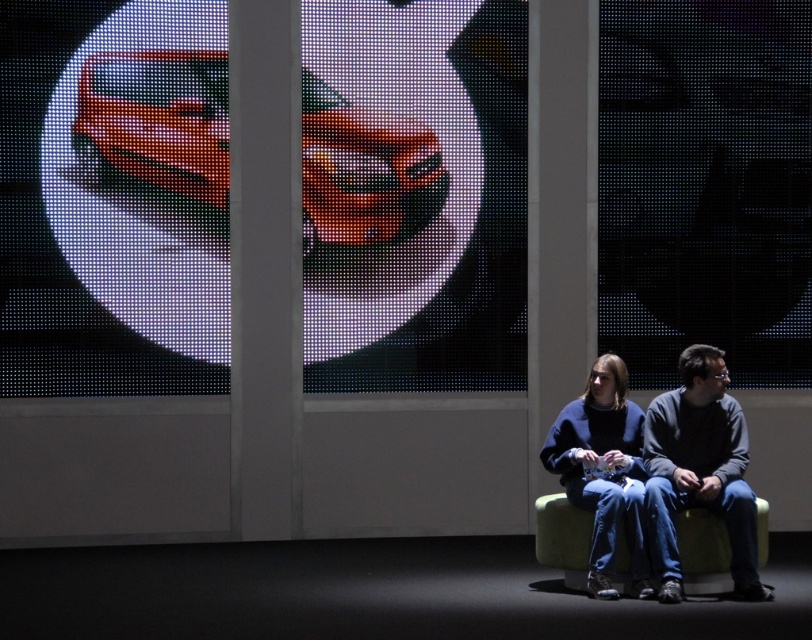
You are a photographer trying to capture a photo of both the dark gray sweater at center right and the blue fleece sweater at center. Based on their height, which one should you focus on first to ensure both are in frame?

The dark gray sweater at center right is much taller than the blue fleece sweater at center, so you should focus on the dark gray sweater at center right first to ensure both are in frame.